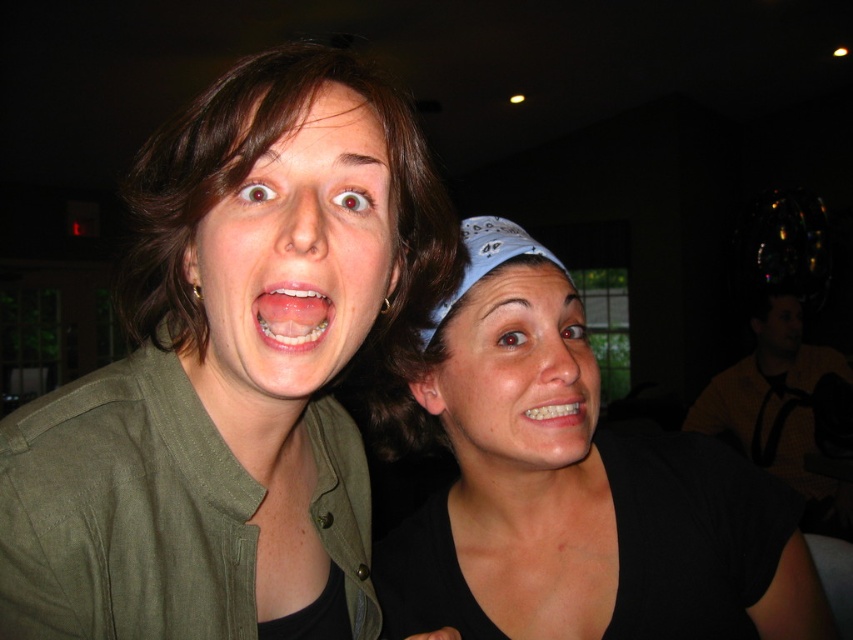
You are a photographer adjusting the lighting for a closeup shot of the black matte bandana at center and the white glossy teeth at lower center. To ensure both objects are well lit, where should you place the light source relative to the subject?

The black matte bandana at center is positioned under the white glossy teeth at lower center, so placing the light source above the subject will illuminate both objects effectively.

You are a photographer setting up for a group photo. You have a camera with a 4.5 inch wide lens. You need to position yourself so that the green matte jacket at upper left and the matte white teeth at center are both in frame. Can you fit both objects within the camera lens width?

The distance between the green matte jacket at upper left and the matte white teeth at center is 5.75 inches. Since the camera lens is only 4.5 inches wide, you cannot fit both objects within the lens width as the distance between them exceeds the lens capacity.